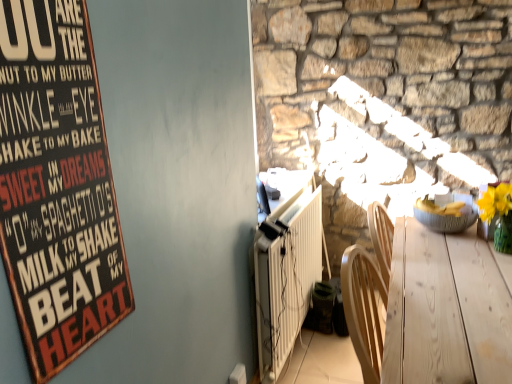
Question: Considering the relative sizes of white textured radiator at lower center and light wood table at lower right in the image provided, is white textured radiator at lower center wider than light wood table at lower right?

Choices:
 (A) no
 (B) yes

Answer: (A)

Question: Is white textured radiator at lower center located outside light wood table at lower right?

Choices:
 (A) yes
 (B) no

Answer: (A)

Question: From a real-world perspective, is white textured radiator at lower center on top of light wood table at lower right?

Choices:
 (A) no
 (B) yes

Answer: (A)

Question: From the image's perspective, is white textured radiator at lower center located beneath light wood table at lower right?

Choices:
 (A) no
 (B) yes

Answer: (A)

Question: Is white textured radiator at lower center shorter than light wood table at lower right?

Choices:
 (A) no
 (B) yes

Answer: (B)

Question: In terms of size, does matte gray bowl at right appear bigger or smaller than wooden signboard at upper left?

Choices:
 (A) big
 (B) small

Answer: (A)

Question: Considering the positions of point (432, 205) and point (53, 89), is point (432, 205) closer or farther from the camera than point (53, 89)?

Choices:
 (A) farther
 (B) closer

Answer: (A)

Question: Visually, is matte gray bowl at right positioned to the left or to the right of wooden signboard at upper left?

Choices:
 (A) right
 (B) left

Answer: (A)

Question: From a real-world perspective, is matte gray bowl at right above or below wooden signboard at upper left?

Choices:
 (A) below
 (B) above

Answer: (A)

Question: Is light wood table at lower right wider or thinner than matte gray bowl at right?

Choices:
 (A) wide
 (B) thin

Answer: (A)

Question: From the image's perspective, is light wood table at lower right positioned above or below matte gray bowl at right?

Choices:
 (A) below
 (B) above

Answer: (A)

Question: From a real-world perspective, is light wood table at lower right physically located above or below matte gray bowl at right?

Choices:
 (A) above
 (B) below

Answer: (B)

Question: Considering the positions of light wood table at lower right and matte gray bowl at right in the image, is light wood table at lower right taller or shorter than matte gray bowl at right?

Choices:
 (A) short
 (B) tall

Answer: (B)

Question: In terms of size, does white textured radiator at lower center appear bigger or smaller than wooden signboard at upper left?

Choices:
 (A) small
 (B) big

Answer: (B)

Question: Does point (266, 307) appear closer or farther from the camera than point (58, 223)?

Choices:
 (A) closer
 (B) farther

Answer: (B)